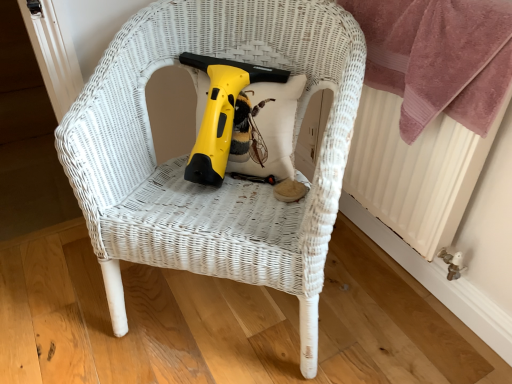
Locate an element on the screen. This screenshot has width=512, height=384. vacant space situated on the left part of white wicker chair at center is located at coordinates (x=57, y=301).